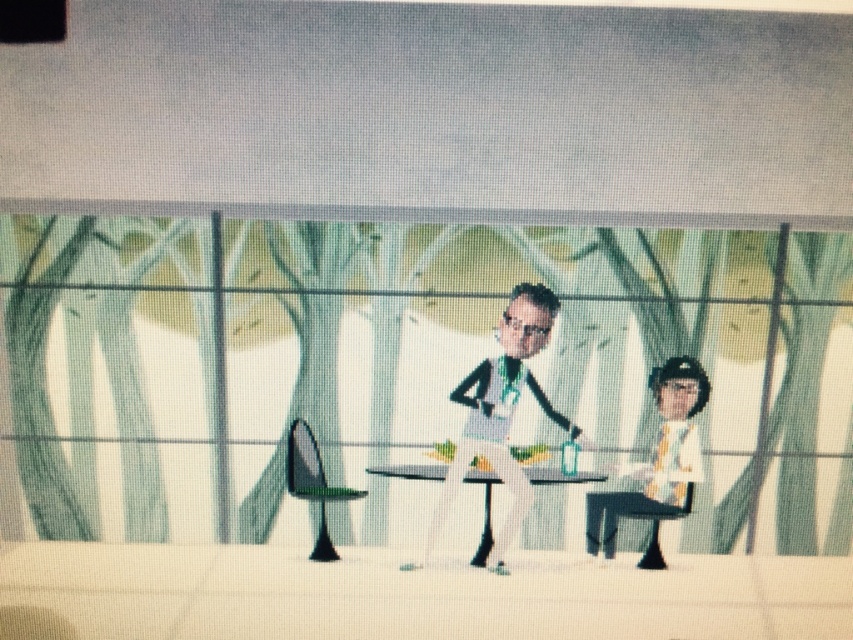
Consider the image. Does matte white suit at center have a smaller size compared to yellow tie at right?

Actually, matte white suit at center might be larger than yellow tie at right.

Who is lower down, matte white suit at center or yellow tie at right?

Positioned lower is yellow tie at right.

Image resolution: width=853 pixels, height=640 pixels. Describe the element at coordinates (500, 412) in the screenshot. I see `matte white suit at center` at that location.

At what (x,y) coordinates should I click in order to perform the action: click on matte white suit at center. Please return your answer as a coordinate pair (x, y). This screenshot has width=853, height=640. Looking at the image, I should click on (500, 412).

Does matte white suit at center have a larger size compared to white glossy table at center?

Indeed, matte white suit at center has a larger size compared to white glossy table at center.

Locate an element on the screen. The image size is (853, 640). matte white suit at center is located at coordinates (500, 412).

Can you confirm if yellow tie at right is positioned above white glossy table at center?

Correct, yellow tie at right is located above white glossy table at center.

Is point (685, 372) positioned in front of point (486, 474)?

Yes, point (685, 372) is in front of point (486, 474).

Between point (682, 477) and point (479, 476), which one is positioned in front?

Positioned in front is point (682, 477).

Locate an element on the screen. yellow tie at right is located at coordinates (659, 461).